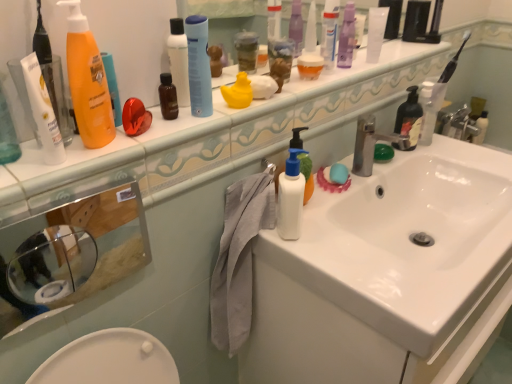
Question: Considering the relative sizes of black matte soap dispenser at right, the second toiletry positioned from the right, and white glossy sink at upper center in the image provided, is black matte soap dispenser at right, the second toiletry positioned from the right, wider than white glossy sink at upper center?

Choices:
 (A) no
 (B) yes

Answer: (A)

Question: From the image's perspective, is black matte soap dispenser at right, the sixth toiletry in the left-to-right sequence, under white glossy sink at upper center?

Choices:
 (A) no
 (B) yes

Answer: (B)

Question: Considering the relative sizes of black matte soap dispenser at right, the second toiletry positioned from the right, and white glossy sink at upper center in the image provided, is black matte soap dispenser at right, the second toiletry positioned from the right, thinner than white glossy sink at upper center?

Choices:
 (A) yes
 (B) no

Answer: (A)

Question: Is black matte soap dispenser at right, the second toiletry positioned from the right, beside white glossy sink at upper center?

Choices:
 (A) no
 (B) yes

Answer: (A)

Question: From a real-world perspective, is black matte soap dispenser at right, the sixth toiletry in the left-to-right sequence, positioned over white glossy sink at upper center based on gravity?

Choices:
 (A) yes
 (B) no

Answer: (B)

Question: From the image's perspective, is white glossy sink at center positioned above or below translucent plastic bottle at upper right, the first cleaning product in the right-to-left sequence?

Choices:
 (A) above
 (B) below

Answer: (B)

Question: Is white glossy sink at center inside or outside of translucent plastic bottle at upper right, placed as the third cleaning product when sorted from front to back?

Choices:
 (A) outside
 (B) inside

Answer: (A)

Question: Based on their positions, is white glossy sink at center located to the left or right of translucent plastic bottle at upper right, the first cleaning product positioned from the back?

Choices:
 (A) right
 (B) left

Answer: (B)

Question: From a real-world perspective, is white glossy sink at center positioned above or below translucent plastic bottle at upper right, the first cleaning product in the right-to-left sequence?

Choices:
 (A) below
 (B) above

Answer: (A)

Question: Relative to white glossy sink at upper center, is gray fabric towel at center in front or behind?

Choices:
 (A) front
 (B) behind

Answer: (B)

Question: In terms of size, does gray fabric towel at center appear bigger or smaller than white glossy sink at upper center?

Choices:
 (A) big
 (B) small

Answer: (A)

Question: In terms of height, does gray fabric towel at center look taller or shorter compared to white glossy sink at upper center?

Choices:
 (A) short
 (B) tall

Answer: (B)

Question: Is gray fabric towel at center inside the boundaries of white glossy sink at upper center, or outside?

Choices:
 (A) inside
 (B) outside

Answer: (B)

Question: Considering the positions of point (317, 61) and point (400, 145), is point (317, 61) closer or farther from the camera than point (400, 145)?

Choices:
 (A) closer
 (B) farther

Answer: (A)

Question: Considering their positions, is translucent plastic container at upper center, which is the third toiletry from left to right, located in front of or behind silver metallic faucet at sink right?

Choices:
 (A) front
 (B) behind

Answer: (B)